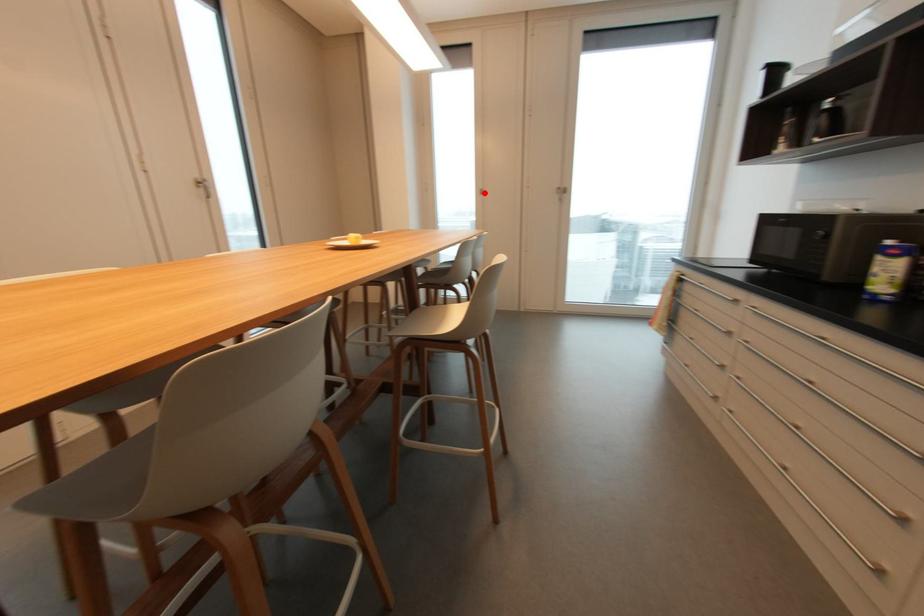
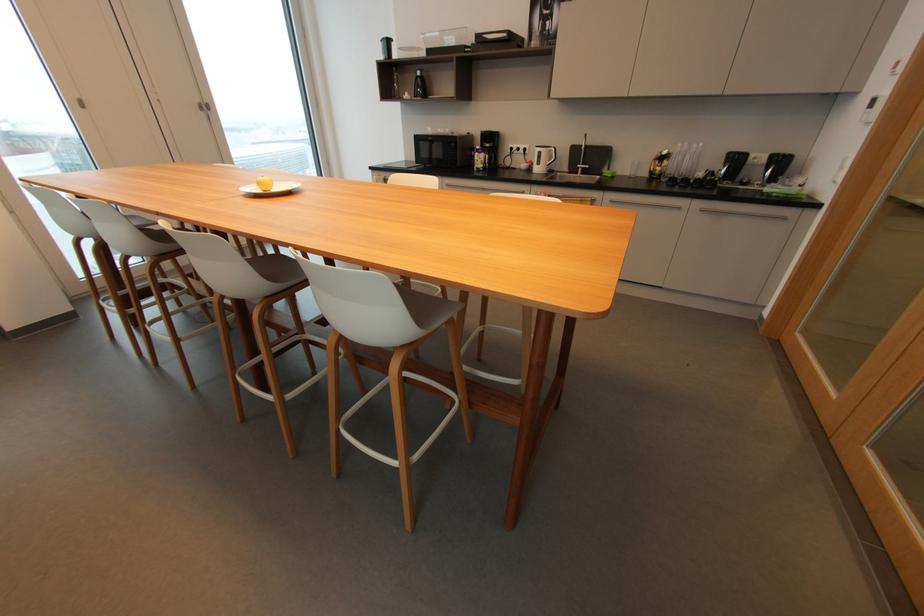
Where in the second image is the point corresponding to the highlighted location from the first image?

(81, 103)